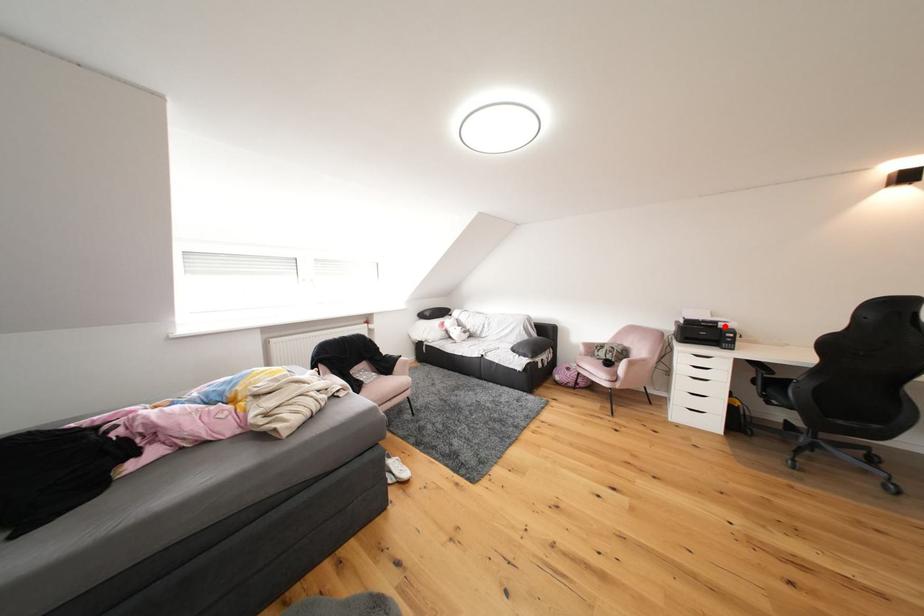
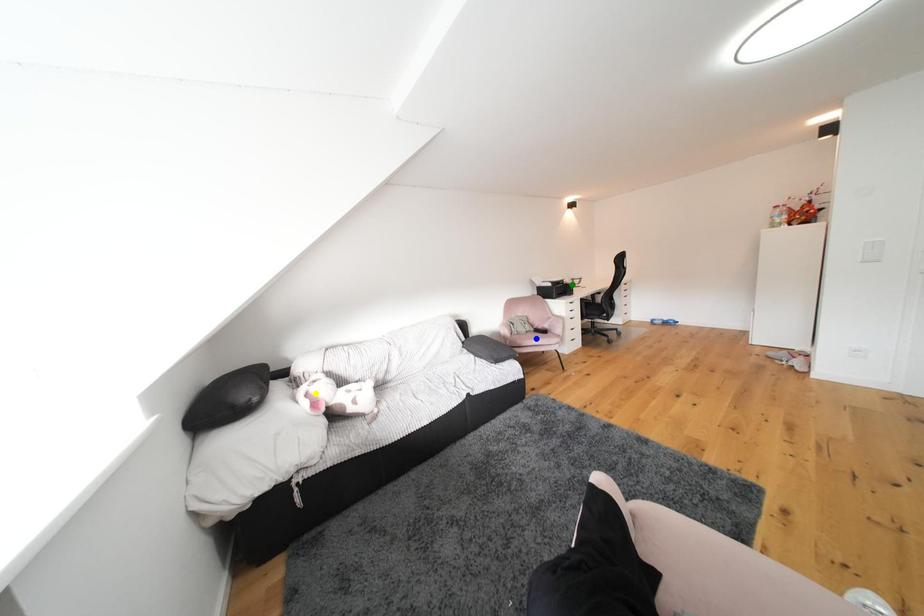
Question: I am providing you with two images of the same scene from different viewpoints. A red point is marked on the first image. You are given multiple points on the second image. Can you choose the point in image 2 that corresponds to the point in image 1?

Choices:
 (A) green point
 (B) yellow point
 (C) blue point

Answer: (A)